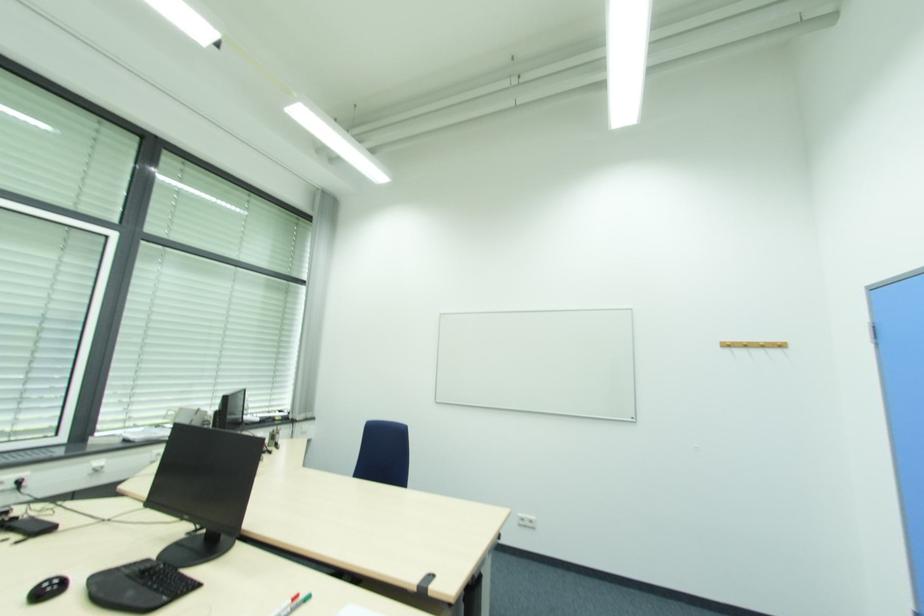
Where is `black keyboard`? black keyboard is located at coordinates (161, 583).